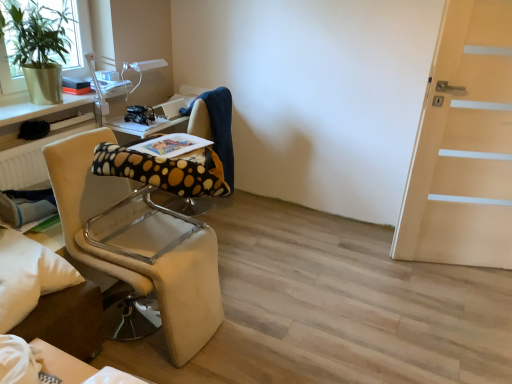
Question: From the image's perspective, is metallic silver table at upper left located above beige fabric chair at left?

Choices:
 (A) no
 (B) yes

Answer: (B)

Question: Considering the relative sizes of metallic silver table at upper left and beige fabric chair at left in the image provided, is metallic silver table at upper left shorter than beige fabric chair at left?

Choices:
 (A) no
 (B) yes

Answer: (B)

Question: Is metallic silver table at upper left aimed at beige fabric chair at left?

Choices:
 (A) yes
 (B) no

Answer: (B)

Question: Is metallic silver table at upper left not close to beige fabric chair at left?

Choices:
 (A) yes
 (B) no

Answer: (B)

Question: Does metallic silver table at upper left appear on the left side of beige fabric chair at left?

Choices:
 (A) no
 (B) yes

Answer: (B)

Question: From the image's perspective, is beige fabric chair at left positioned above or below light wood door at right?

Choices:
 (A) above
 (B) below

Answer: (B)

Question: Which is correct: beige fabric chair at left is inside light wood door at right, or outside of it?

Choices:
 (A) inside
 (B) outside

Answer: (B)

Question: Is point (141, 271) positioned closer to the camera than point (475, 216)?

Choices:
 (A) closer
 (B) farther

Answer: (A)

Question: Looking at their shapes, would you say beige fabric chair at left is wider or thinner than light wood door at right?

Choices:
 (A) thin
 (B) wide

Answer: (B)

Question: From a real-world perspective, is green matte plant at upper left positioned above or below polka dot fabric computer chair at center?

Choices:
 (A) above
 (B) below

Answer: (A)

Question: From the image's perspective, relative to polka dot fabric computer chair at center, is green matte plant at upper left above or below?

Choices:
 (A) below
 (B) above

Answer: (B)

Question: Relative to polka dot fabric computer chair at center, is green matte plant at upper left in front or behind?

Choices:
 (A) front
 (B) behind

Answer: (A)

Question: Which is correct: green matte plant at upper left is inside polka dot fabric computer chair at center, or outside of it?

Choices:
 (A) inside
 (B) outside

Answer: (B)

Question: From the image's perspective, is green matte plant at upper left positioned above or below light wood door at right?

Choices:
 (A) above
 (B) below

Answer: (A)

Question: Does point (31, 9) appear closer or farther from the camera than point (507, 117)?

Choices:
 (A) farther
 (B) closer

Answer: (A)